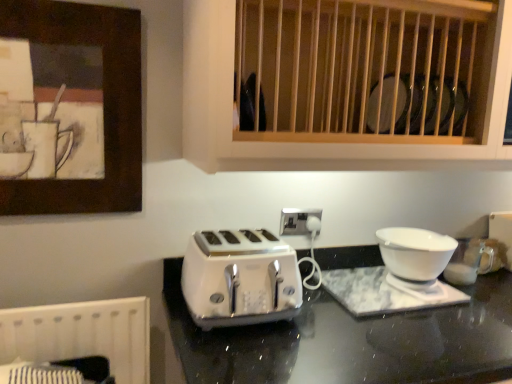
Question: Would you say wooden slats at upper center is inside or outside white plastic electric outlet at center?

Choices:
 (A) outside
 (B) inside

Answer: (A)

Question: Does point (504, 157) appear closer or farther from the camera than point (284, 216)?

Choices:
 (A) closer
 (B) farther

Answer: (A)

Question: Which is nearer to the white glossy bowl at right?

Choices:
 (A) white glossy toaster at center
 (B) wooden slats at upper center
 (C) white plastic electric outlet at center
 (D) wooden picture frame at upper left

Answer: (C)

Question: Which of these objects is positioned closest to the white glossy bowl at right?

Choices:
 (A) wooden picture frame at upper left
 (B) white plastic electric outlet at center
 (C) wooden slats at upper center
 (D) white glossy toaster at center

Answer: (B)